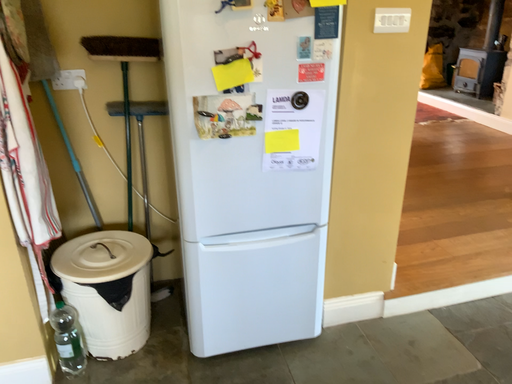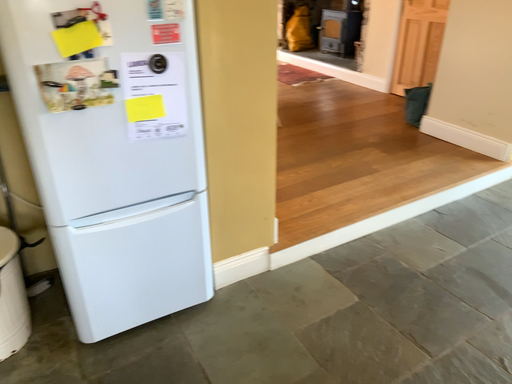
Question: Which way did the camera rotate in the video?

Choices:
 (A) rotated left
 (B) rotated right

Answer: (B)